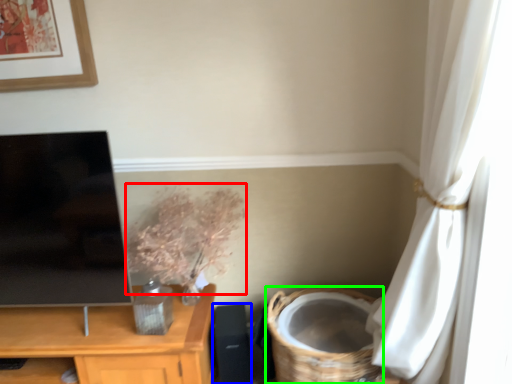
Question: Based on their relative distances, which object is farther from floral arrangement (highlighted by a red box)? Choose from speaker (highlighted by a blue box) and basket (highlighted by a green box).

Choices:
 (A) speaker
 (B) basket

Answer: (B)